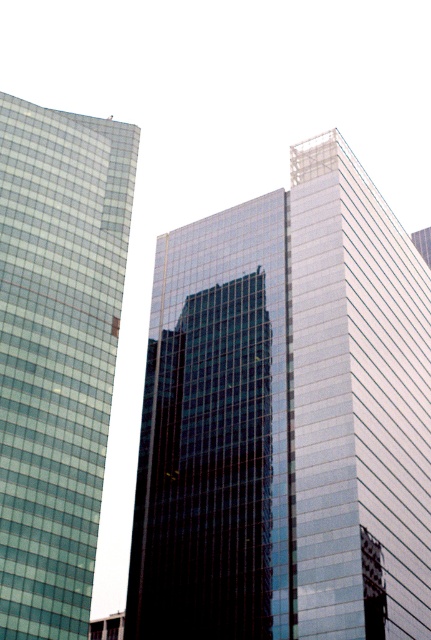
Question: Can you confirm if glassy reflective skyscraper at center is positioned to the right of green glass building at left?

Choices:
 (A) yes
 (B) no

Answer: (A)

Question: Which point appears farthest from the camera in this image?

Choices:
 (A) (52, 285)
 (B) (393, 369)

Answer: (A)

Question: Which of the following is the closest to the observer?

Choices:
 (A) (237, 525)
 (B) (131, 157)

Answer: (A)

Question: Can you confirm if glassy reflective skyscraper at center is smaller than green glass building at left?

Choices:
 (A) yes
 (B) no

Answer: (B)

Question: Is glassy reflective skyscraper at center smaller than green glass building at left?

Choices:
 (A) yes
 (B) no

Answer: (B)